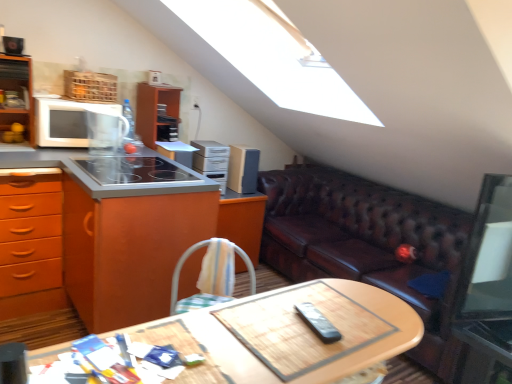
Locate an element on the screen. The image size is (512, 384). free spot in front of black plastic remote at center, which is counted as the 4th appliance, starting from the back is located at coordinates (311, 357).